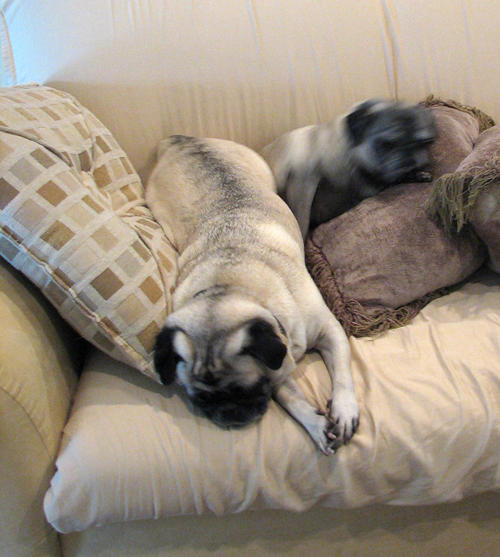
Image resolution: width=500 pixels, height=557 pixels. I want to click on cream couch, so click(36, 373).